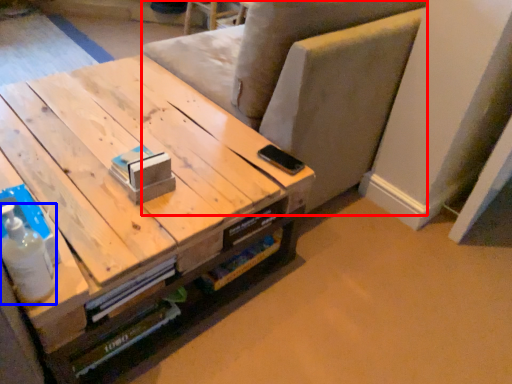
Question: Which object appears farthest to the camera in this image, armchair (highlighted by a red box) or bottle (highlighted by a blue box)?

Choices:
 (A) armchair
 (B) bottle

Answer: (A)